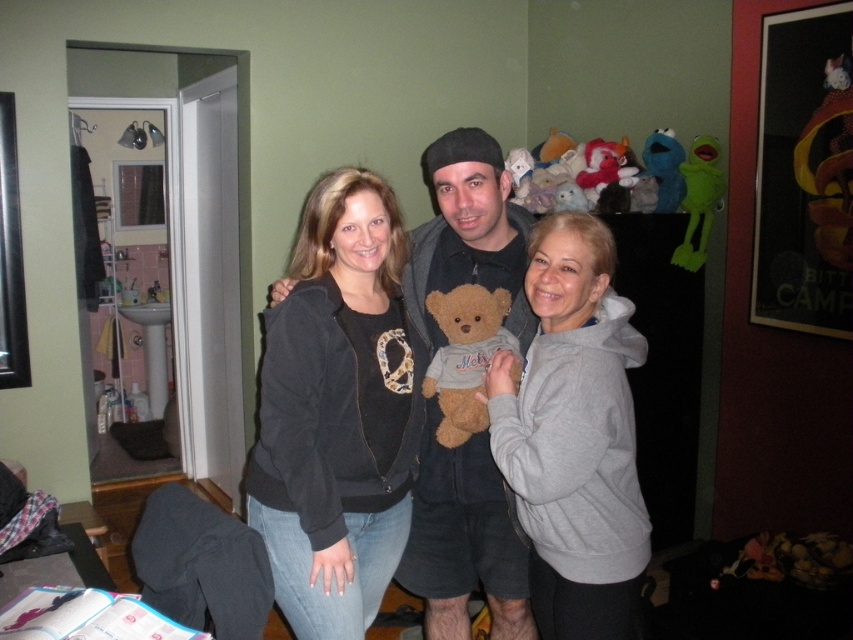
You are standing in the bathroom and want to reach the sink which is at point (578, 305). If you can only move forward in a straight line, will you collide with any of the three people standing in the room?

The distance between you and the sink at point (578, 305) is 1.58 meters. Since the three people are standing close together in front of the bathroom, moving straight towards the sink may result in a collision with them.

You are a photographer trying to capture a closeup shot of the brown plush teddy bear at center. Given that your camera can focus clearly on objects between 1.5 meters and 2.0 meters away, will the teddy bear be in focus?

The brown plush teddy bear at center is 1.72 meters away from the camera, which falls within the focus range of 1.5 to 2.0 meters. Therefore, the teddy bear will be in focus.

You are trying to find the black matte jacket at center in the photo. Where should you look relative to the green rubber frog at upper right?

The black matte jacket at center is positioned on the left side of green rubber frog at upper right, so you should look to the left of the green rubber frog at upper right to find it.